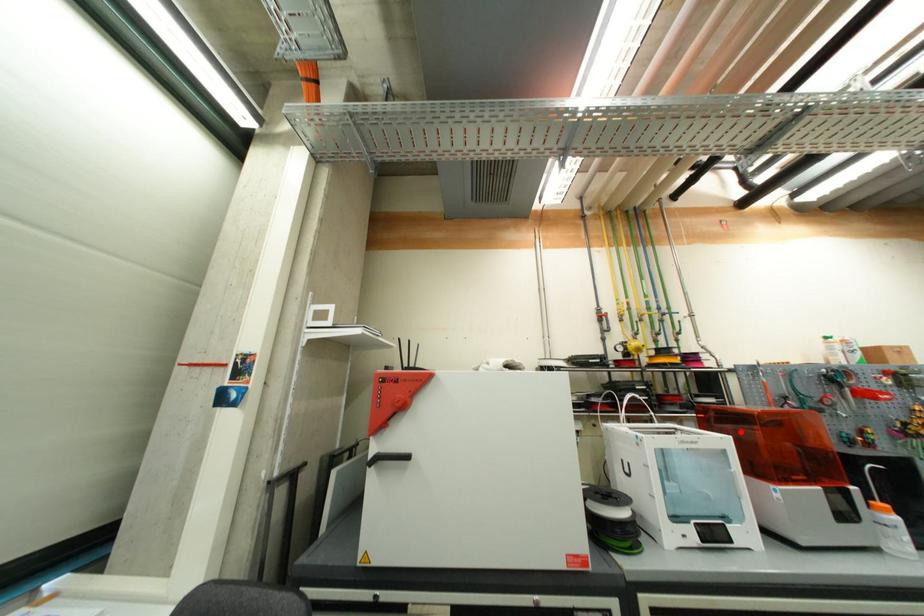
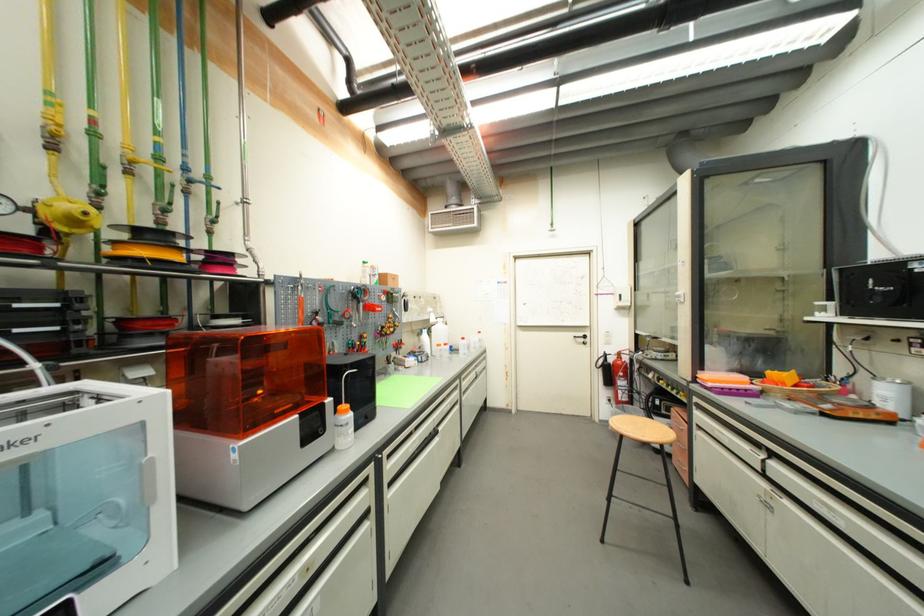
The point at the highlighted location is marked in the first image. Where is the corresponding point in the second image?

(237, 363)